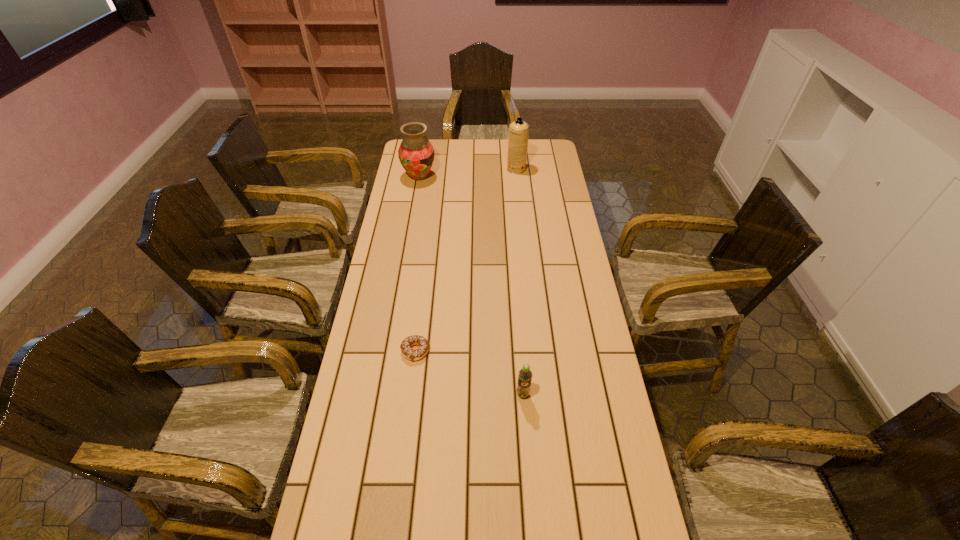
This screenshot has height=540, width=960. What are the coordinates of `aerosol can` in the screenshot? It's located at (518, 135).

Where is `vase`? vase is located at coordinates (416, 154).

At what (x,y) coordinates should I click in order to perform the action: click on soda. Please return your answer as a coordinate pair (x, y). The height and width of the screenshot is (540, 960). Looking at the image, I should click on (525, 375).

Identify the location of the nearest object. This screenshot has width=960, height=540. (525, 375).

I want to click on doughnut, so coord(411,354).

At what (x,y) coordinates should I click in order to perform the action: click on the second nearest object. Please return your answer as a coordinate pair (x, y). Looking at the image, I should click on (411, 354).

Identify the location of vacant space situated 0.200m on the front of the aerosol can. (519, 200).

In order to click on vacant space located 0.270m on the front of the vase in this screenshot , I will do `click(411, 225)`.

I want to click on free space located 0.250m on the front label of the nearest object, so click(530, 494).

You are a GUI agent. You are given a task and a screenshot of the screen. Output one action in this format:
    pyautogui.click(x=<x>, y=<y>)
    Task: Click on the free space located on the right of the shortest object
    This screenshot has width=960, height=540.
    Given the screenshot: What is the action you would take?
    pyautogui.click(x=520, y=351)